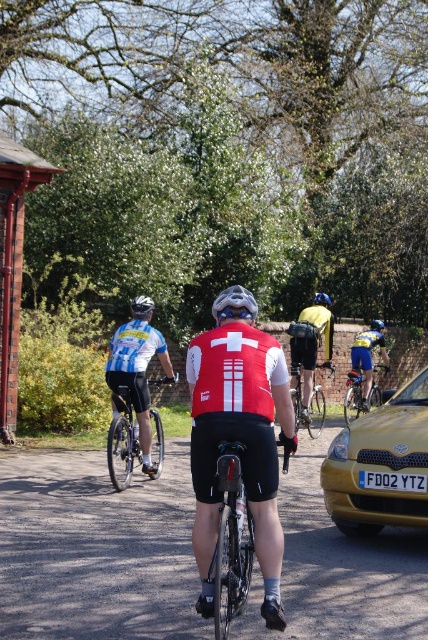
Is point (359, 500) positioned before point (320, 304)?

That is True.

Find the location of `yellow matte car at lower right`. yellow matte car at lower right is located at coordinates (380, 465).

Does matte red cycling jersey at center appear on the right side of shiny black bicycle at center?

Yes, matte red cycling jersey at center is to the right of shiny black bicycle at center.

This screenshot has height=640, width=428. What do you see at coordinates (240, 444) in the screenshot? I see `matte red cycling jersey at center` at bounding box center [240, 444].

Is point (196, 396) farther from camera compared to point (237, 540)?

Yes, point (196, 396) is farther from viewer.

The width and height of the screenshot is (428, 640). Find the location of `matte red cycling jersey at center`. matte red cycling jersey at center is located at coordinates (240, 444).

What do you see at coordinates (309, 404) in the screenshot? I see `shiny silver bicycle at center` at bounding box center [309, 404].

Which is above, shiny silver bicycle at center or blue matte helmet at center?

blue matte helmet at center is higher up.

The image size is (428, 640). Identify the location of shiny silver bicycle at center. (309, 404).

At what (x,y) coordinates should I click in order to perform the action: click on shiny silver bicycle at center. Please return your answer as a coordinate pair (x, y). This screenshot has width=428, height=640. Looking at the image, I should click on (309, 404).